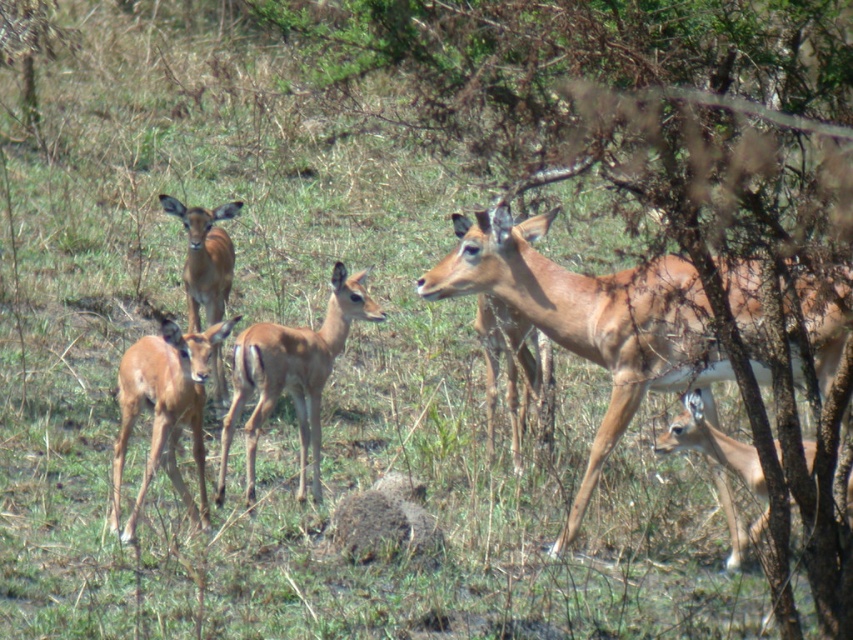
Question: Does brown matte deer at left appear over brown matte/deer at upper left?

Choices:
 (A) yes
 (B) no

Answer: (B)

Question: Based on their relative distances, which object is nearer to the brown matte deer at left?

Choices:
 (A) brown matte/deer at lower right
 (B) brown wood tree at center

Answer: (A)

Question: Is brown wood tree at center thinner than brown matte deer at left?

Choices:
 (A) yes
 (B) no

Answer: (B)

Question: Which object is the farthest from the brown wood tree at center?

Choices:
 (A) brown smooth deer at center
 (B) brown matte/deer at lower right
 (C) brown matte/deer at upper left
 (D) light brown fur at right

Answer: (C)

Question: Among these objects, which one is farthest from the camera?

Choices:
 (A) brown matte/deer at lower right
 (B) light brown fur at right
 (C) brown smooth deer at center

Answer: (C)

Question: Is brown smooth deer at center thinner than brown matte/deer at upper left?

Choices:
 (A) no
 (B) yes

Answer: (A)